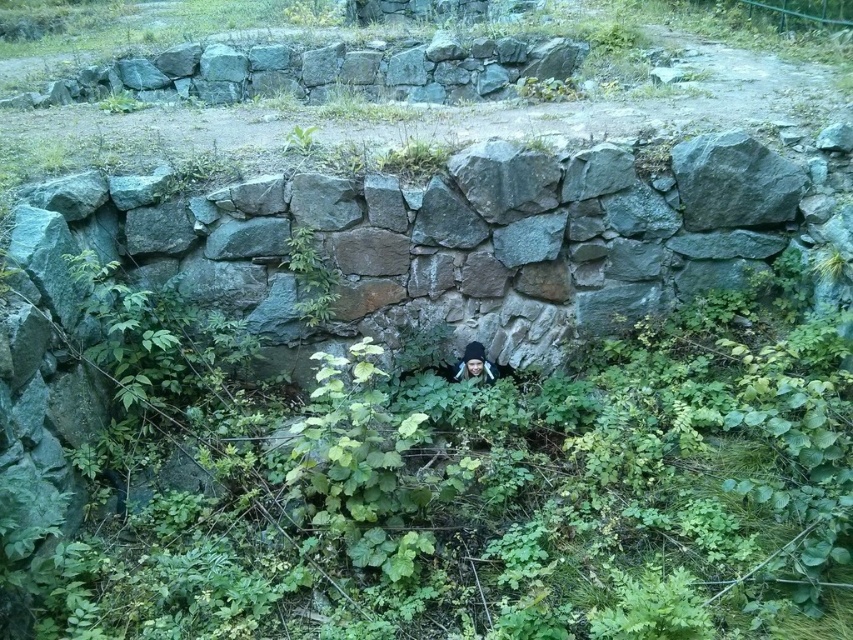
Looking at this image, you are a hiker who wants to take a photo of the gray rough stone wall at upper center and the green leafy plant at center. Since you want both to be clearly visible in the frame, which object should you focus on to ensure it appears sharp?

You should focus on the gray rough stone wall at upper center because it is bigger than the green leafy plant at center, so focusing on the larger object will help ensure both are in focus.

You are standing in front of the stone structure and notice a green leafy plant at center and a black knit cap at center. Which object is taller?

The green leafy plant at center is much taller than the black knit cap at center.

You are standing in front of the stone structure and need to locate the gray rough stone wall at upper center. According to the coordinates provided, where exactly is it positioned?

The gray rough stone wall at upper center is located at point coordinates of 0.111 in the x and 0.380 in the y.